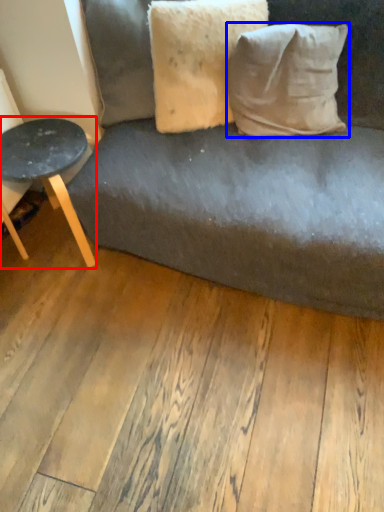
Question: Among these objects, which one is farthest to the camera, table (highlighted by a red box) or pillow (highlighted by a blue box)?

Choices:
 (A) table
 (B) pillow

Answer: (A)